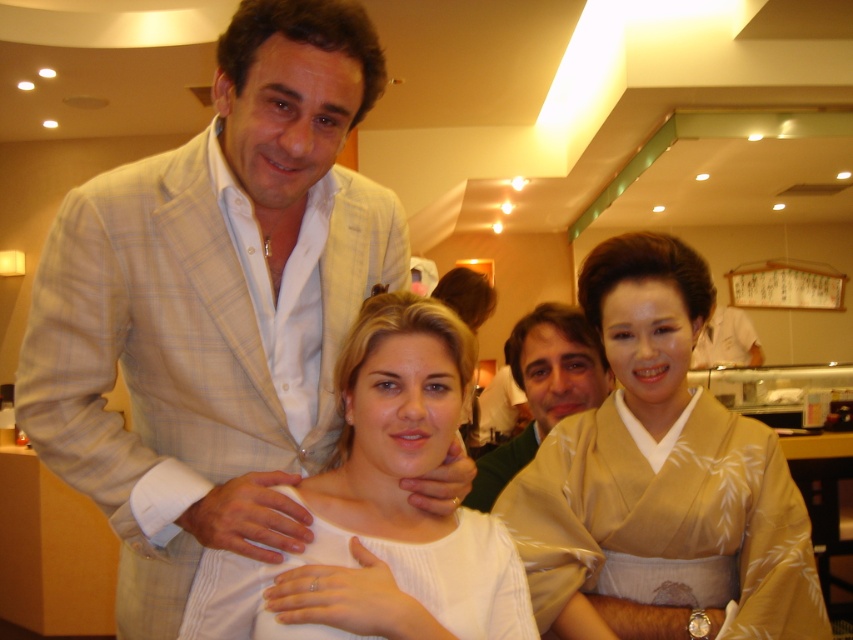
Question: Which point is closer to the camera?

Choices:
 (A) (192, 252)
 (B) (527, 636)
 (C) (535, 534)

Answer: (B)

Question: Considering the real-world distances, which object is farthest from the beige silk kimono at center?

Choices:
 (A) white ribbed sweater at center
 (B) light beige plaid suit at left
 (C) light brown sweater at center
 (D) white ribbed dress at center

Answer: (B)

Question: Estimate the real-world distances between objects in this image. Which object is closer to the light brown sweater at center?

Choices:
 (A) beige silk kimono at center
 (B) white ribbed sweater at center
 (C) light beige plaid suit at left

Answer: (A)

Question: Is light beige plaid suit at left positioned behind light brown sweater at center?

Choices:
 (A) no
 (B) yes

Answer: (A)

Question: Can you confirm if beige silk kimono at center is positioned above white ribbed dress at center?

Choices:
 (A) yes
 (B) no

Answer: (A)

Question: Can you confirm if light beige plaid suit at left is positioned to the left of white ribbed sweater at center?

Choices:
 (A) no
 (B) yes

Answer: (B)